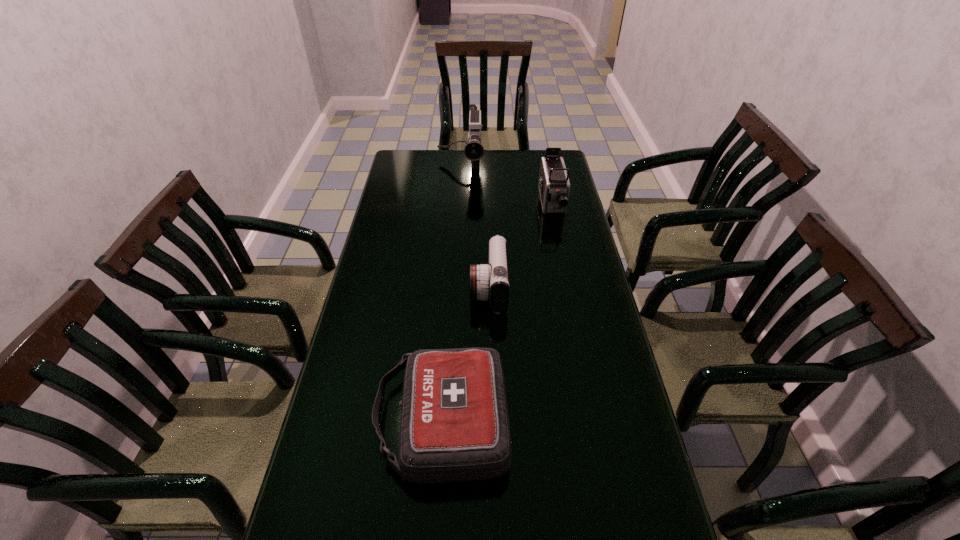
Locate an element on the screen. free spot between the farthest object and the rightmost camcorder is located at coordinates (506, 185).

Locate an element on the screen. The width and height of the screenshot is (960, 540). free spot between the nearest object and the farthest object is located at coordinates (451, 294).

The width and height of the screenshot is (960, 540). I want to click on free space between the farthest object and the third farthest object, so click(x=474, y=228).

Locate an element on the screen. The width and height of the screenshot is (960, 540). free space that is in between the second shortest object and the rightmost camcorder is located at coordinates click(x=520, y=246).

I want to click on free space between the shortest object and the farthest object, so click(451, 294).

Locate an element on the screen. The height and width of the screenshot is (540, 960). vacant space in between the farthest camcorder and the second nearest camcorder is located at coordinates (506, 185).

This screenshot has height=540, width=960. What are the coordinates of `the second closest object to the second farthest camcorder` in the screenshot? It's located at (490, 282).

Identify which object is the third closest to the shortest object. Please provide its 2D coordinates. Your answer should be formatted as a tuple, i.e. [(x, y)], where the tuple contains the x and y coordinates of a point satisfying the conditions above.

[(474, 151)]

You are a GUI agent. You are given a task and a screenshot of the screen. Output one action in this format:
    pyautogui.click(x=<x>, y=<y>)
    Task: Click on the second closest camcorder to the nearest camcorder
    This screenshot has width=960, height=540.
    Given the screenshot: What is the action you would take?
    pyautogui.click(x=474, y=151)

Locate an element on the screen. This screenshot has height=540, width=960. the closest camcorder to the rightmost object is located at coordinates (474, 151).